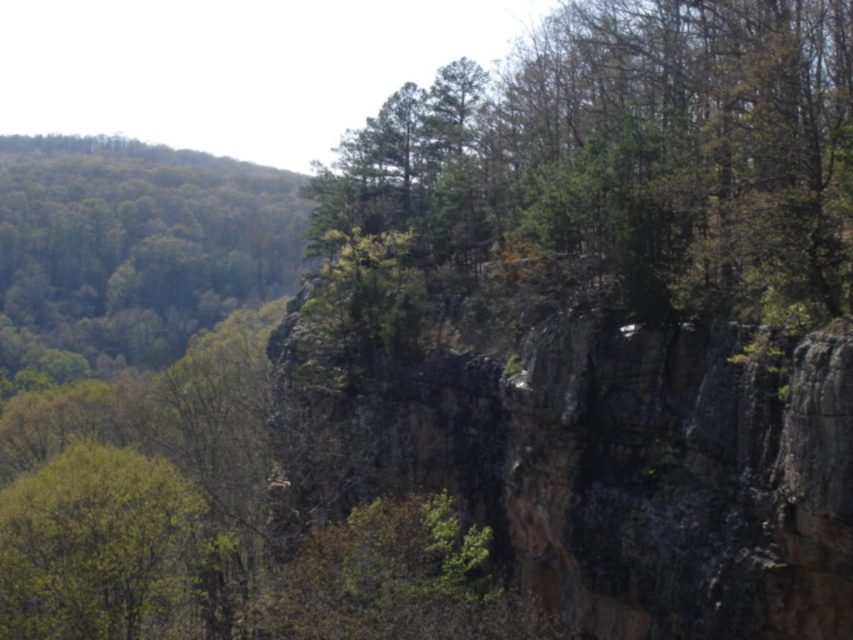
You are a hiker standing at the base of the rocky cliff and want to reach the highest point of the green leafy tree at center or the green leafy tree at lower left. Which tree should you choose to climb to reach the highest elevation?

The green leafy tree at center has a greater height compared to the green leafy tree at lower left. Therefore, climbing the green leafy tree at center would allow you to reach a higher elevation.

You are standing at the base of the cliff and see two points marked on the cliff face. The first point is at coordinates point (795, 232) and the second is at point (123, 604). Which point is closer to you?

Point (795, 232) is in front of point (123, 604), so it is closer to you.